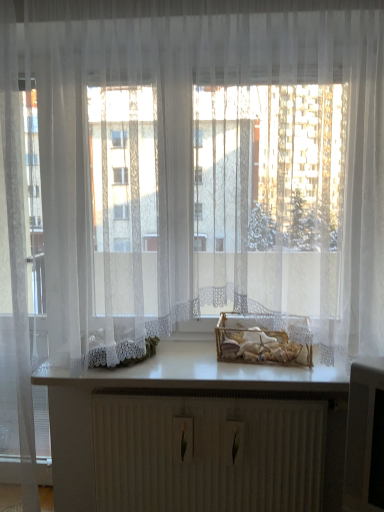
Question: Should I look upward or downward to see white matte counter top at center?

Choices:
 (A) down
 (B) up

Answer: (A)

Question: Does white matte counter top at center have a smaller size compared to translucent glass basket at center?

Choices:
 (A) no
 (B) yes

Answer: (A)

Question: Is white matte counter top at center not close to translucent glass basket at center?

Choices:
 (A) yes
 (B) no

Answer: (B)

Question: Can you confirm if white matte counter top at center is taller than translucent glass basket at center?

Choices:
 (A) yes
 (B) no

Answer: (B)

Question: From the image's perspective, is white matte counter top at center located beneath translucent glass basket at center?

Choices:
 (A) no
 (B) yes

Answer: (B)

Question: Considering the relative sizes of white matte counter top at center and translucent glass basket at center in the image provided, is white matte counter top at center bigger than translucent glass basket at center?

Choices:
 (A) no
 (B) yes

Answer: (B)

Question: Considering the relative sizes of white matte counter top at center and translucent glass basket at center in the image provided, is white matte counter top at center thinner than translucent glass basket at center?

Choices:
 (A) yes
 (B) no

Answer: (B)

Question: Can you confirm if transparent glass door at left is taller than translucent glass basket at center?

Choices:
 (A) no
 (B) yes

Answer: (B)

Question: From the image's perspective, is transparent glass door at left located beneath translucent glass basket at center?

Choices:
 (A) yes
 (B) no

Answer: (B)

Question: Could you tell me if transparent glass door at left is turned towards translucent glass basket at center?

Choices:
 (A) no
 (B) yes

Answer: (A)

Question: Does transparent glass door at left have a lesser height compared to translucent glass basket at center?

Choices:
 (A) no
 (B) yes

Answer: (A)

Question: Is transparent glass door at left with translucent glass basket at center?

Choices:
 (A) yes
 (B) no

Answer: (B)

Question: Is transparent glass door at left positioned with its back to translucent glass basket at center?

Choices:
 (A) yes
 (B) no

Answer: (B)

Question: Does white matte counter top at center appear on the right side of white textured radiator at center?

Choices:
 (A) yes
 (B) no

Answer: (B)